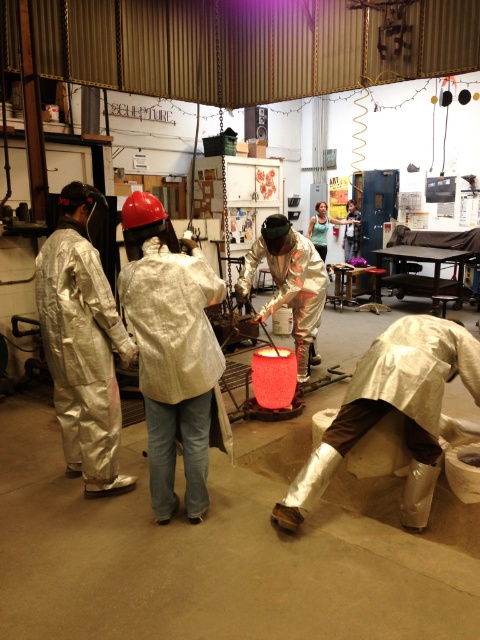
Is silver reflective suit at left wider than matte silver helmet at center?

No, silver reflective suit at left is not wider than matte silver helmet at center.

Which is more to the left, silver reflective suit at left or matte silver helmet at center?

silver reflective suit at left is more to the left.

Locate an element on the screen. The width and height of the screenshot is (480, 640). silver reflective suit at left is located at coordinates (83, 342).

Between point (175, 353) and point (274, 237), which one is positioned behind?

Point (274, 237)

Is white reflective suit at center positioned in front of metallic reflective suit at center?

Yes, it is.

This screenshot has height=640, width=480. I want to click on white reflective suit at center, so click(173, 353).

This screenshot has height=640, width=480. What are the coordinates of `white reflective suit at center` in the screenshot? It's located at (173, 353).

Which is more to the left, red glowing molten at lower center or silver reflective suit at lower right?

From the viewer's perspective, red glowing molten at lower center appears more on the left side.

Does red glowing molten at lower center appear under silver reflective suit at lower right?

Yes, red glowing molten at lower center is below silver reflective suit at lower right.

Where is `red glowing molten at lower center`? This screenshot has width=480, height=640. red glowing molten at lower center is located at coordinates (222, 552).